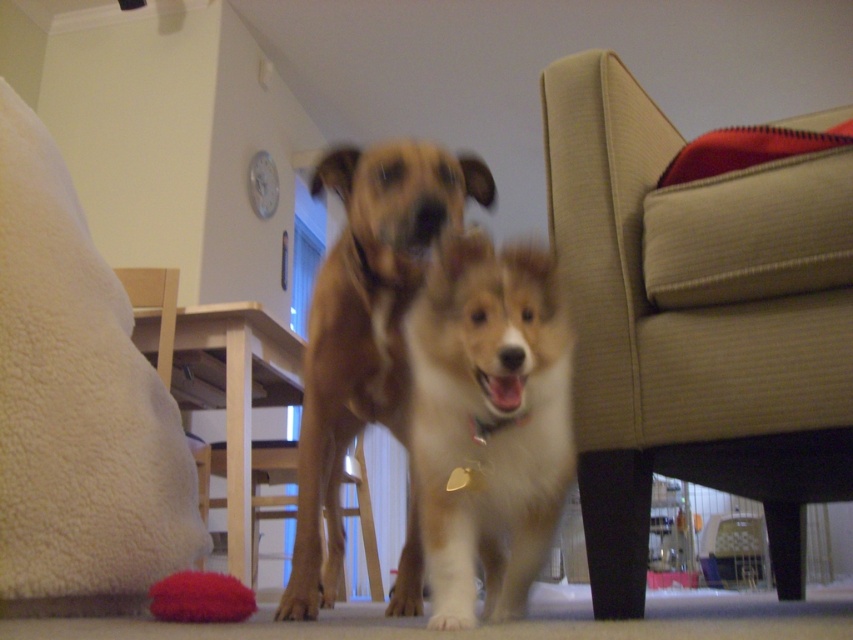
Question: Does fuzzy brown dog at center appear under brown fur paw at center?

Choices:
 (A) no
 (B) yes

Answer: (A)

Question: Which object appears closest to the camera in this image?

Choices:
 (A) brown fur paw at center
 (B) brown fur dog at center
 (C) fuzzy red ball at lower left

Answer: (C)

Question: Is fuzzy red ball at lower left positioned behind brown fur paw at center?

Choices:
 (A) no
 (B) yes

Answer: (A)

Question: Which point is closer to the camera?

Choices:
 (A) (315, 582)
 (B) (354, 380)
 (C) (410, 435)
 (D) (601, 424)

Answer: (D)

Question: Is fuzzy brown dog at center thinner than fuzzy red ball at lower left?

Choices:
 (A) no
 (B) yes

Answer: (A)

Question: Which object appears closest to the camera in this image?

Choices:
 (A) brown fur paw at center
 (B) fuzzy red ball at lower left

Answer: (B)